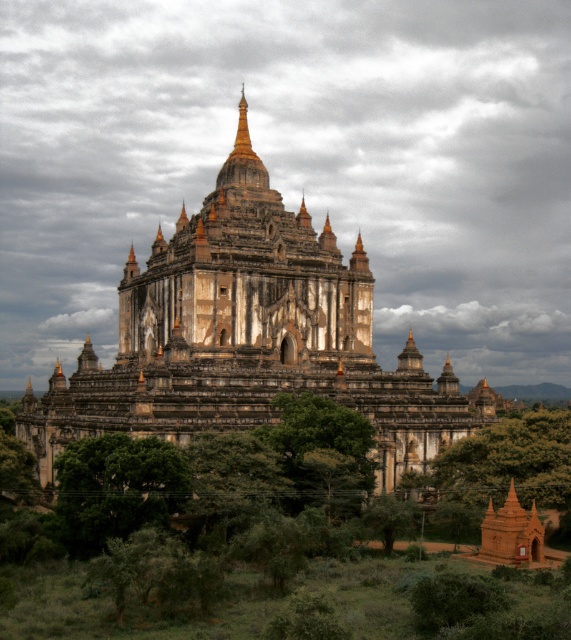
You are a photographer planning to capture the golden stone temple at center and the green leafy tree at lower left in a single frame. Based on their sizes in the image, which object would appear larger in your photo?

The golden stone temple at center appears larger in the photo because it is taller than the green leafy tree at lower left.

You are a tourist standing at the entrance of the temple complex. You see the golden stone temple at center and the green leafy tree at lower left. Which object is higher in the image?

The golden stone temple at center is located above the green leafy tree at lower left, so the golden stone temple at center is higher in the image.

You are a photographer planning to capture the golden stone temple at center and the green leafy tree at center in a single frame. Considering their heights, which object will appear taller in the photograph?

The golden stone temple at center will appear taller in the photograph because it has a greater height compared to the green leafy tree at center.